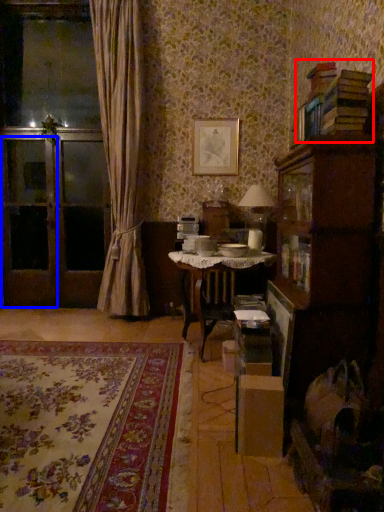
Question: Which object appears farthest to the camera in this image, book (highlighted by a red box) or screen door (highlighted by a blue box)?

Choices:
 (A) book
 (B) screen door

Answer: (B)